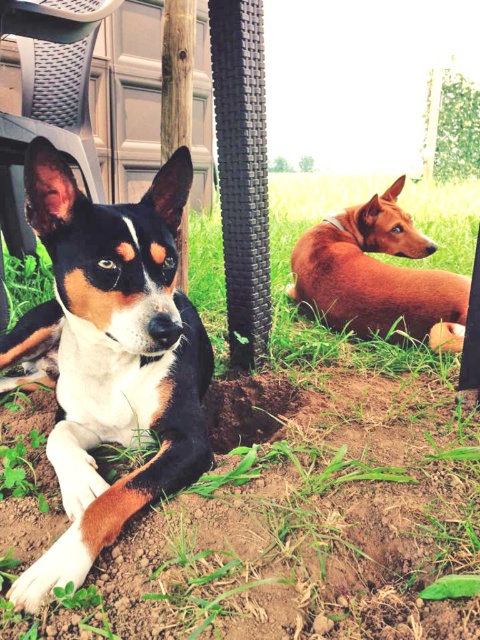
Question: Which of the following is the closest to the observer?

Choices:
 (A) (180, 161)
 (B) (427, 413)
 (C) (216, 420)
 (D) (467, 289)

Answer: (A)

Question: Is green grass at center closer to camera compared to brown smooth dog at lower right?

Choices:
 (A) yes
 (B) no

Answer: (A)

Question: Based on their relative distances, which object is nearer to the brown smooth dog at lower right?

Choices:
 (A) green grass at center
 (B) white fur dog at center

Answer: (B)

Question: Can you confirm if green grass at center is positioned below dirt at center?

Choices:
 (A) no
 (B) yes

Answer: (B)

Question: Based on their relative distances, which object is nearer to the green grass at center?

Choices:
 (A) dirt at center
 (B) white fur dog at center
 (C) brown smooth dog at lower right

Answer: (B)

Question: Does green grass at center come behind dirt at center?

Choices:
 (A) yes
 (B) no

Answer: (B)